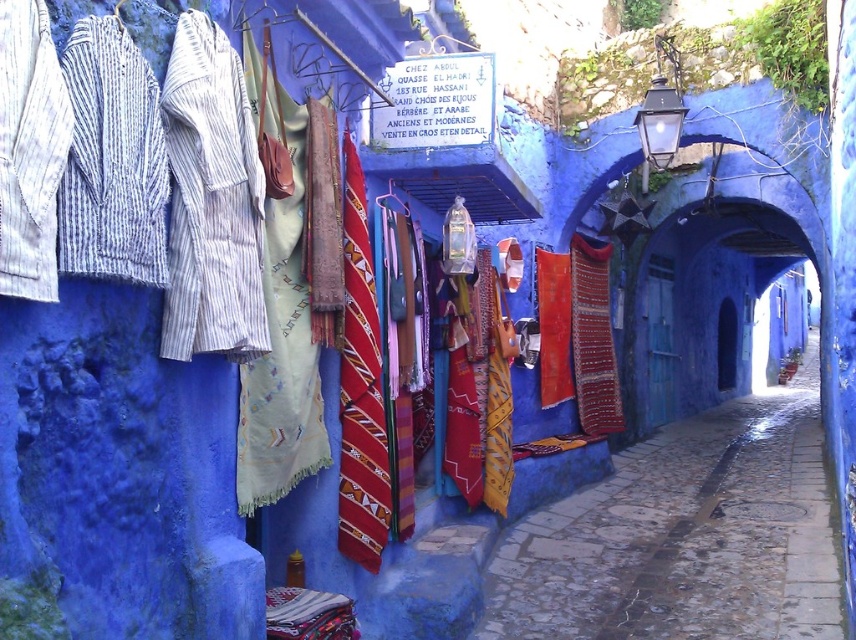
Based on the photo, who is more forward, (363, 218) or (385, 205)?

Point (363, 218) is more forward.

Between red woven fabric tie at center and matte fabric bag at center, which one is positioned higher?

Positioned higher is matte fabric bag at center.

Between point (349, 337) and point (379, 198), which one is positioned behind?

Positioned behind is point (379, 198).

The height and width of the screenshot is (640, 856). I want to click on red woven fabric tie at center, so click(360, 387).

Can you confirm if smooth cobblestone alley at center is thinner than matte fabric bag at center?

No, smooth cobblestone alley at center is not thinner than matte fabric bag at center.

From the picture: Who is higher up, smooth cobblestone alley at center or matte fabric bag at center?

Positioned higher is matte fabric bag at center.

Is point (730, 561) positioned in front of point (387, 196)?

That is False.

Locate an element on the screen. This screenshot has width=856, height=640. smooth cobblestone alley at center is located at coordinates (685, 536).

Is smooth cobblestone alley at center to the right of red woven fabric tie at center from the viewer's perspective?

Indeed, smooth cobblestone alley at center is positioned on the right side of red woven fabric tie at center.

Between point (750, 602) and point (346, 132), which one is positioned in front?

Point (346, 132)

Locate an element on the screen. The image size is (856, 640). smooth cobblestone alley at center is located at coordinates pyautogui.click(x=685, y=536).